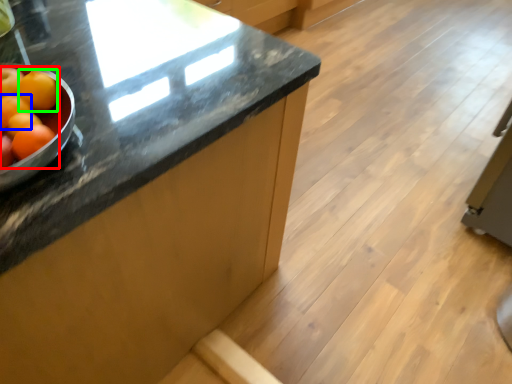
Question: Based on their relative distances, which object is farther from grapefruit (highlighted by a red box)? Choose from orange (highlighted by a blue box) and tangerine (highlighted by a green box).

Choices:
 (A) orange
 (B) tangerine

Answer: (A)